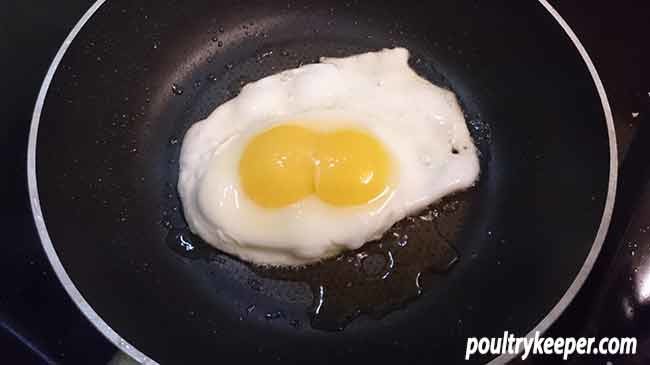
Find the location of a particular element. The image size is (650, 365). rim of pan is located at coordinates (600, 239).